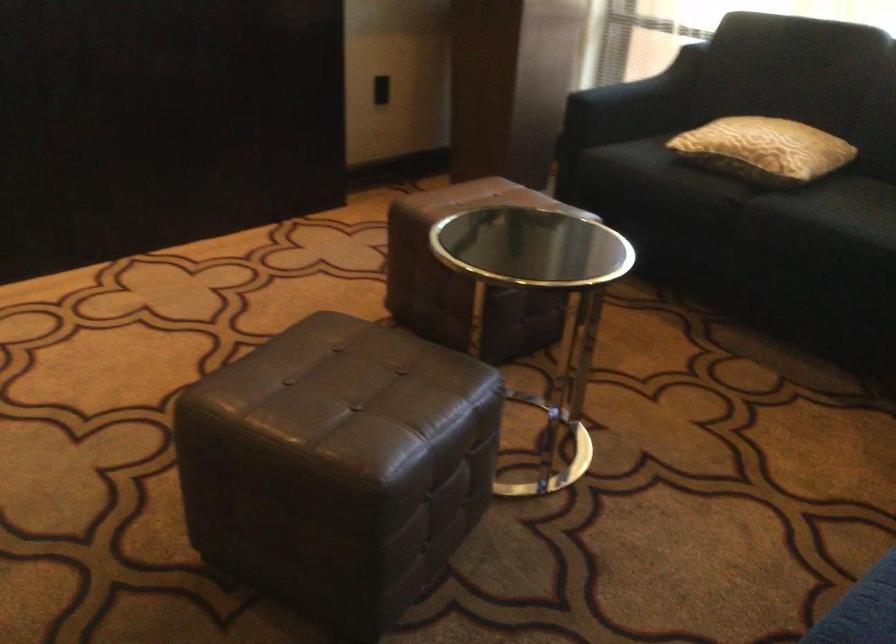
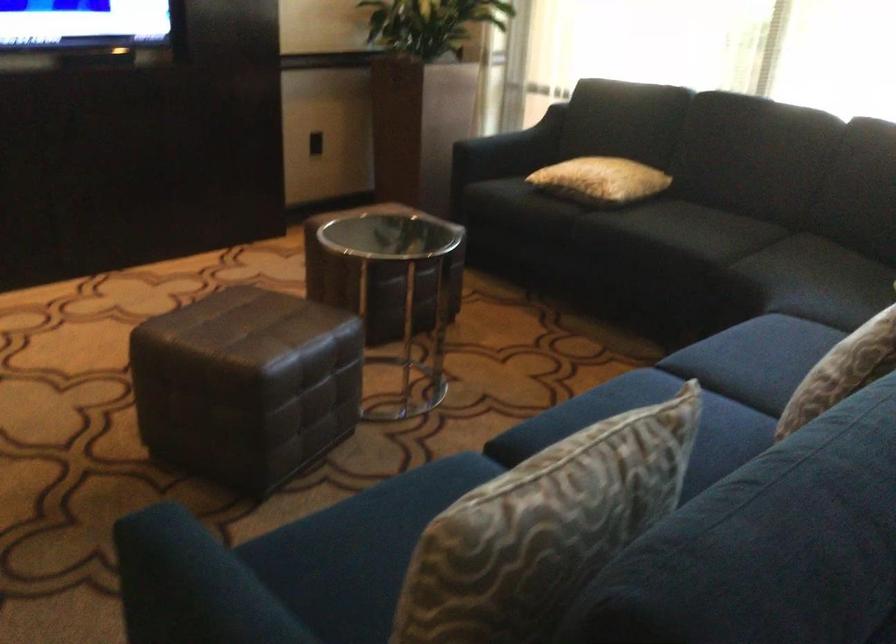
Question: The first image is from the beginning of the video and the second image is from the end. How did the camera likely rotate when shooting the video?

Choices:
 (A) Left
 (B) Right
 (C) Up
 (D) Down

Answer: (C)